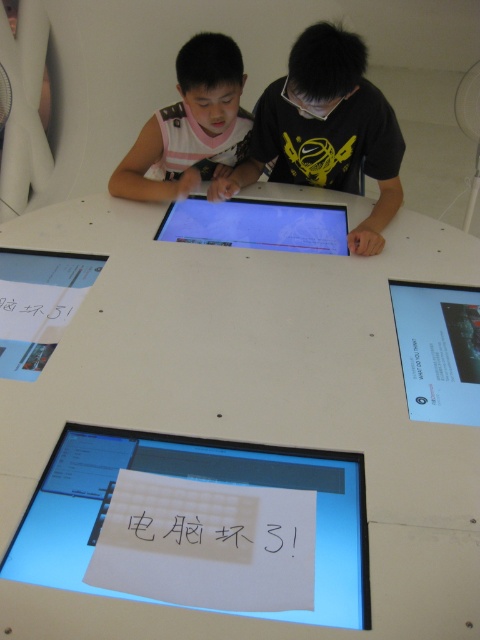
Question: Which object is farther from the camera taking this photo?

Choices:
 (A) white matte shirt at center
 (B) matte black shirt at center

Answer: (A)

Question: Does matte black computer screen at upper right appear on the right side of matte glass computer screen at center?

Choices:
 (A) yes
 (B) no

Answer: (A)

Question: Can you confirm if white matte table at center is positioned below white matte shirt at center?

Choices:
 (A) yes
 (B) no

Answer: (A)

Question: Among these objects, which one is farthest from the camera?

Choices:
 (A) white paper at bottom center
 (B) white matte shirt at center
 (C) matte black computer screen at upper right

Answer: (B)

Question: Is the position of white matte table at center more distant than that of white paper at bottom center?

Choices:
 (A) yes
 (B) no

Answer: (B)

Question: Which of the following is the farthest from the observer?

Choices:
 (A) (396, 516)
 (B) (431, 310)
 (C) (322, 179)

Answer: (C)